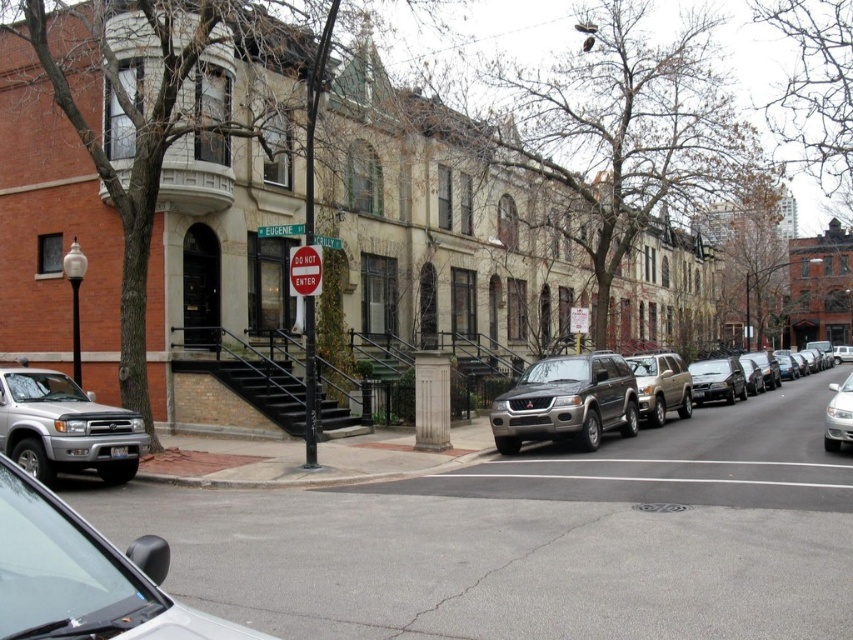
Question: Which point is farther to the camera?

Choices:
 (A) (544, 365)
 (B) (831, 401)

Answer: (A)

Question: Among these points, which one is nearest to the camera?

Choices:
 (A) (74, 440)
 (B) (47, 589)
 (C) (827, 432)
 (D) (717, 371)

Answer: (B)

Question: Does silver metallic suv at lower left appear on the right side of white glossy sedan at right?

Choices:
 (A) yes
 (B) no

Answer: (B)

Question: Is silver metallic suv at lower left thinner than shiny silver sedan at center?

Choices:
 (A) no
 (B) yes

Answer: (A)

Question: Where is metallic silver suv at center located in relation to satin gold suv at center in the image?

Choices:
 (A) left
 (B) right

Answer: (A)

Question: Which of the following is the closest to the observer?

Choices:
 (A) (4, 557)
 (B) (683, 376)

Answer: (A)